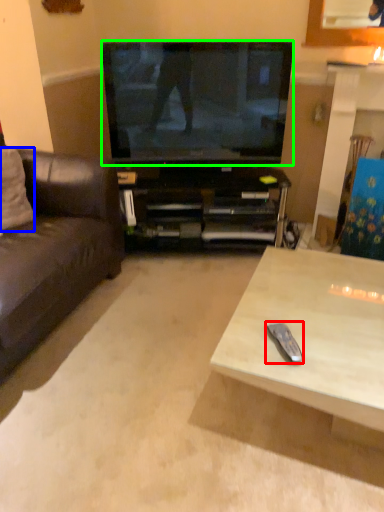
Question: Considering the real-world distances, which object is farthest from remote control (highlighted by a red box)? pillow (highlighted by a blue box) or television (highlighted by a green box)?

Choices:
 (A) pillow
 (B) television

Answer: (A)